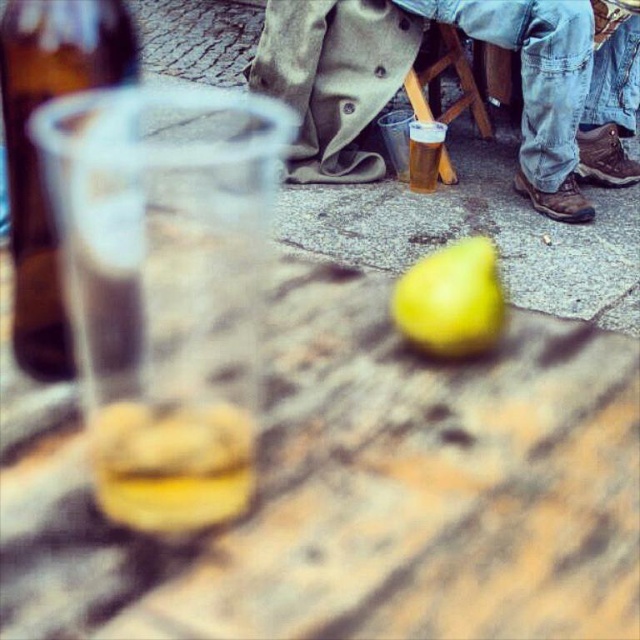
You are a photographer trying to capture a candid shot of the scene. You notice the denim pants at lower right and the brown glass bottle at left. Which object should you focus on if you want to include both in the frame but prioritize the larger one?

The denim pants at lower right is bigger than the brown glass bottle at left, so you should focus on the denim pants at lower right to prioritize the larger object in the frame.

You are a customer at the outdoor table and want to reach for the brown glass bottle at left. Based on its position, where exactly should you look to find it?

The brown glass bottle at left is located at the 2D coordinates of point 0.239 on the x axis and 0.058 on the y axis.

You are a photographer standing at the edge of the scene. You want to take a photo of the wooden table at center and the brown glass bottle at left. Which object will appear larger in your photo?

The wooden table at center will appear larger in the photo because it is closer to the viewer than the brown glass bottle at left.